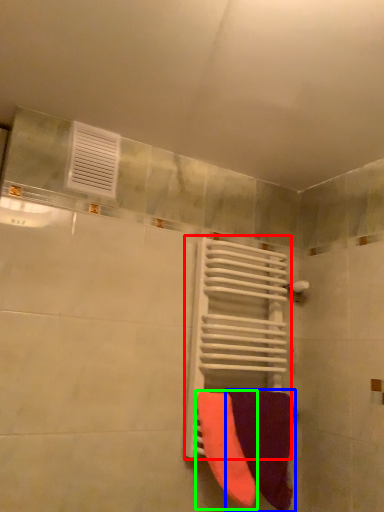
Question: Which is nearer to the radiator (highlighted by a red box)? towel (highlighted by a blue box) or towel (highlighted by a green box).

Choices:
 (A) towel
 (B) towel

Answer: (A)